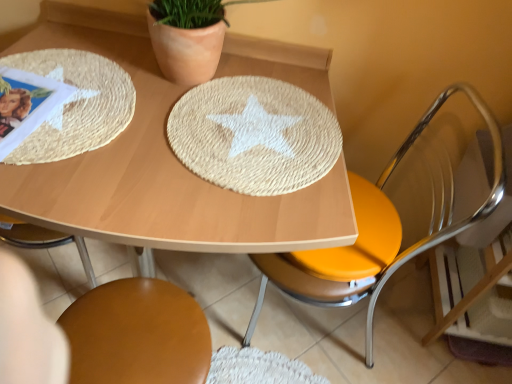
Identify the location of blank space situated above brown leather chair at lower center, acting as the first chair starting from the left (from a real-world perspective). (140, 331).